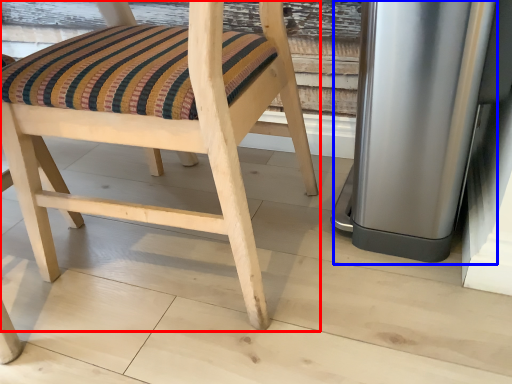
Question: Which object is further to the camera taking this photo, chair (highlighted by a red box) or appliance (highlighted by a blue box)?

Choices:
 (A) chair
 (B) appliance

Answer: (B)